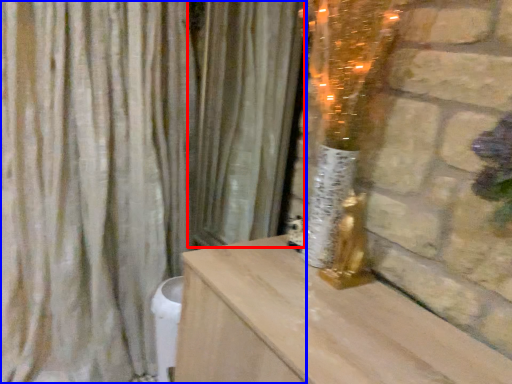
Question: Which object appears closest to the camera in this image, curtain (highlighted by a red box) or curtain (highlighted by a blue box)?

Choices:
 (A) curtain
 (B) curtain

Answer: (B)